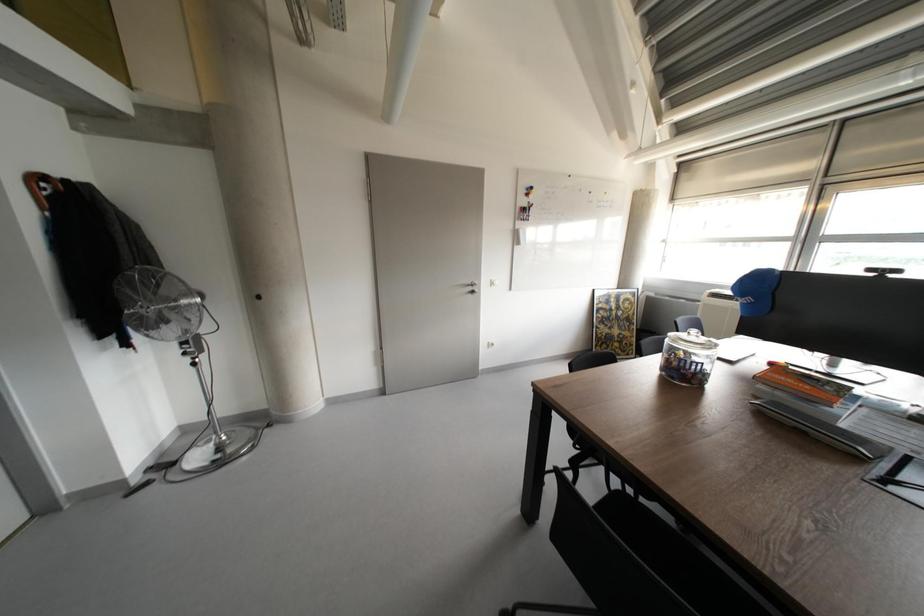
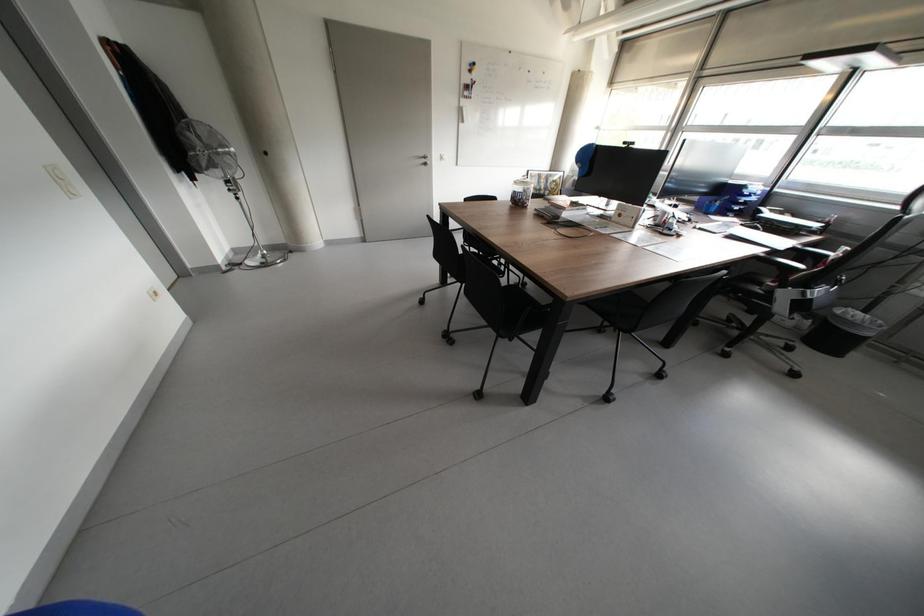
Question: In a continuous first-person perspective shot, in which direction is the camera moving?

Choices:
 (A) Left
 (B) Right
 (C) Forward
 (D) Backward

Answer: (D)